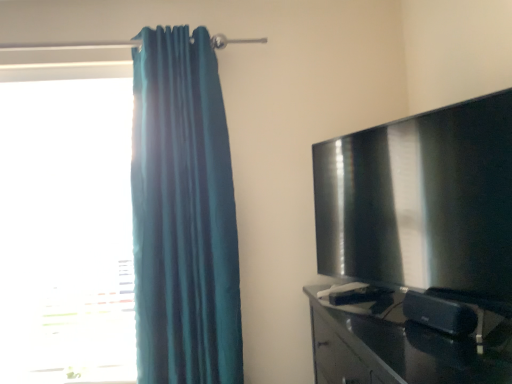
Question: From a real-world perspective, is glossy black tv stand at right positioned above or below matte black tv at right?

Choices:
 (A) below
 (B) above

Answer: (A)

Question: In the image, is glossy black tv stand at right positioned in front of or behind matte black tv at right?

Choices:
 (A) front
 (B) behind

Answer: (A)

Question: Estimate the real-world distances between objects in this image. Which object is farther from the transparent glass window at left?

Choices:
 (A) matte black tv at right
 (B) teal fabric curtain at left
 (C) glossy black tv stand at right

Answer: (A)

Question: Which object is positioned closest to the matte black tv at right?

Choices:
 (A) transparent glass window at left
 (B) teal fabric curtain at left
 (C) glossy black tv stand at right

Answer: (C)